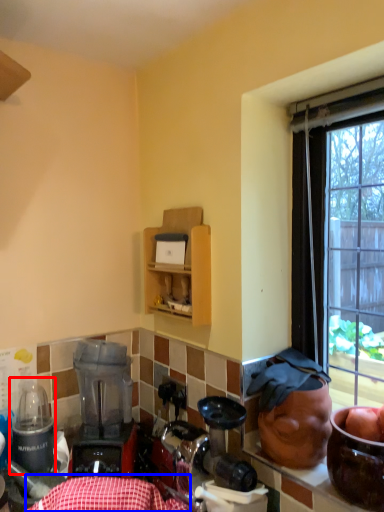
Question: Which point is closer to the camera, appliance (highlighted by a red box) or tablecloth (highlighted by a blue box)?

Choices:
 (A) appliance
 (B) tablecloth

Answer: (B)